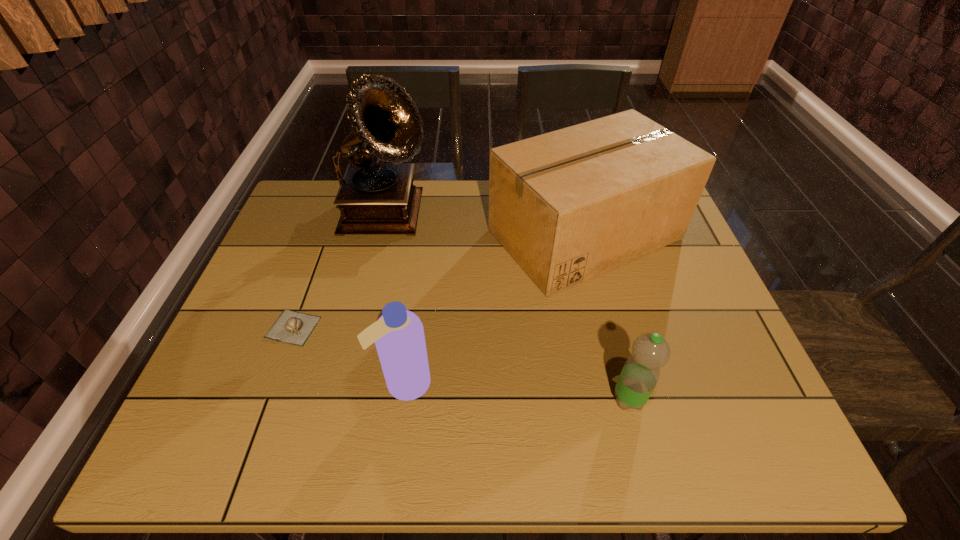
At what (x,y) coordinates should I click in order to perform the action: click on object that is the fourth closest to the box. Please return your answer as a coordinate pair (x, y). This screenshot has height=540, width=960. Looking at the image, I should click on (292, 327).

Find the location of `object that can be found as the third closest to the shampoo`. object that can be found as the third closest to the shampoo is located at coordinates (374, 198).

You are a GUI agent. You are given a task and a screenshot of the screen. Output one action in this format:
    pyautogui.click(x=<x>, y=<y>)
    Task: Click on the vacant space that satisfies the following two spatial constraints: 1. on the back side of the shortest object; 2. on the left side of the box
    Image resolution: width=960 pixels, height=540 pixels.
    Given the screenshot: What is the action you would take?
    pyautogui.click(x=327, y=234)

Find the location of a particular element. The width and height of the screenshot is (960, 540). vacant space that satisfies the following two spatial constraints: 1. on the horn of the shampoo; 2. on the right side of the tallest object is located at coordinates [348, 383].

Find the location of a particular element. vacant space that satisfies the following two spatial constraints: 1. on the front side of the third nearest object; 2. on the right side of the shampoo is located at coordinates (273, 383).

Where is `vacant position in the image that satisfies the following two spatial constraints: 1. on the front side of the garlic; 2. on the right side of the shampoo`? vacant position in the image that satisfies the following two spatial constraints: 1. on the front side of the garlic; 2. on the right side of the shampoo is located at coordinates pyautogui.click(x=273, y=383).

Image resolution: width=960 pixels, height=540 pixels. Identify the location of free location that satisfies the following two spatial constraints: 1. on the horn of the shampoo; 2. on the right side of the tallest object. coord(348,383).

Where is `vacant position in the image that satisfies the following two spatial constraints: 1. on the horn of the tallest object; 2. on the left side of the water bottle`? The image size is (960, 540). vacant position in the image that satisfies the following two spatial constraints: 1. on the horn of the tallest object; 2. on the left side of the water bottle is located at coordinates (345, 399).

Locate an element on the screen. The width and height of the screenshot is (960, 540). free spot that satisfies the following two spatial constraints: 1. on the horn of the box; 2. on the left side of the tallest object is located at coordinates (383, 234).

In order to click on free space that satisfies the following two spatial constraints: 1. on the back side of the shampoo; 2. on the left side of the box in this screenshot , I will do `click(424, 234)`.